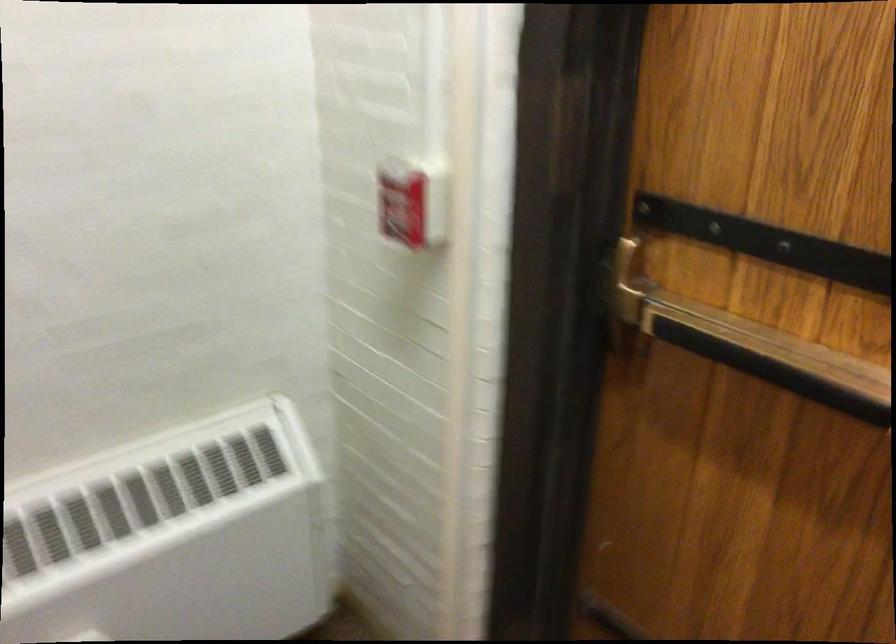
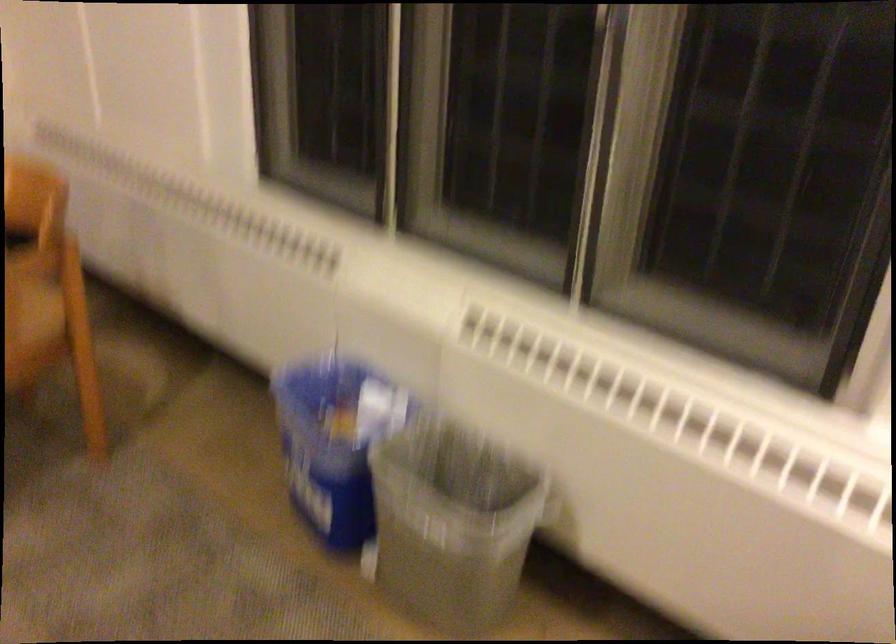
Which direction would the cameraman need to move to produce the second image?

The cameraman walked toward left, forward.